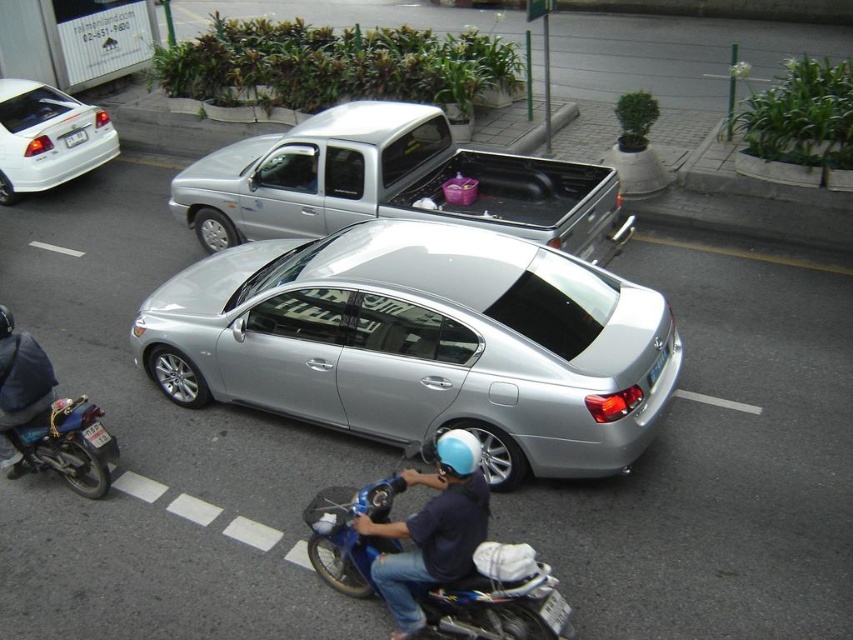
You are a delivery driver who needs to confirm the license plate numbers for two vehicles in front of you. You see the white plastic license plate at lower left and the white plastic license plate at upper left. Which license plate is easier to read from your current position?

The white plastic license plate at lower left is closer to the viewer than the white plastic license plate at upper left, so it is easier to read from your current position.

You are standing at the point with coordinates point (38,166) and want to walk to the point with coordinates point (538,589). Which direction should you face to move towards your destination?

You should face towards the direction of point (538,589), which is in front of point (38,166).